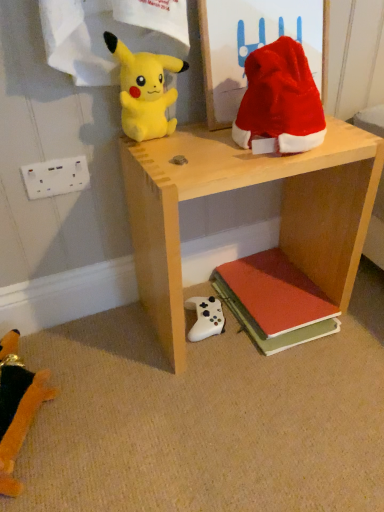
Image resolution: width=384 pixels, height=512 pixels. What do you see at coordinates (239, 188) in the screenshot?
I see `light wood/unfinished wood shelf at center` at bounding box center [239, 188].

This screenshot has height=512, width=384. Find the location of `red matte book at lower right`. red matte book at lower right is located at coordinates (275, 301).

In order to face velvet red santa hat at upper right, which ranks as the second toy in top-to-bottom order, should I rotate leftwards or rightwards?

You should rotate right by 13.252 degrees.

This screenshot has height=512, width=384. Describe the element at coordinates (17, 407) in the screenshot. I see `velvet orange stuffed toy at lower left, which is the 4th toy in top-to-bottom order` at that location.

Where is `light wood/unfinished wood shelf at center`? This screenshot has height=512, width=384. light wood/unfinished wood shelf at center is located at coordinates (239, 188).

Does velvet red santa hat at upper right, the 3th toy from the bottom, have a greater height compared to velvet orange stuffed toy at lower left, which is the 4th toy in top-to-bottom order?

Yes, velvet red santa hat at upper right, the 3th toy from the bottom, is taller than velvet orange stuffed toy at lower left, which is the 4th toy in top-to-bottom order.

Does velvet red santa hat at upper right, the first toy in the right-to-left sequence, have a smaller size compared to velvet orange stuffed toy at lower left, arranged as the first toy when viewed from the left?

No, velvet red santa hat at upper right, the first toy in the right-to-left sequence, is not smaller than velvet orange stuffed toy at lower left, arranged as the first toy when viewed from the left.

From a real-world perspective, starting from the velvet orange stuffed toy at lower left, which ranks as the 1th toy in bottom-to-top order, which toy is the 1st one vertically above it? Please provide its 2D coordinates.

[(280, 99)]

From a real-world perspective, who is located lower, velvet red santa hat at upper right, the 3th toy from the bottom, or velvet orange stuffed toy at lower left, which is the 4th toy in top-to-bottom order?

A: velvet orange stuffed toy at lower left, which is the 4th toy in top-to-bottom order.

How many degrees apart are the facing directions of light wood/unfinished wood shelf at center and yellow plush toy at upper left, the third toy when ordered from right to left?

There is a 3.13-degree angle between the facing directions of light wood/unfinished wood shelf at center and yellow plush toy at upper left, the third toy when ordered from right to left.

Do you think light wood/unfinished wood shelf at center is within yellow plush toy at upper left, the second toy when ordered from left to right, or outside of it?

light wood/unfinished wood shelf at center cannot be found inside yellow plush toy at upper left, the second toy when ordered from left to right.

Considering the sizes of objects light wood/unfinished wood shelf at center and yellow plush toy at upper left, which is counted as the first toy, starting from the top, in the image provided, who is shorter, light wood/unfinished wood shelf at center or yellow plush toy at upper left, which is counted as the first toy, starting from the top,?

yellow plush toy at upper left, which is counted as the first toy, starting from the top, is shorter.

Which is in front, point (7, 344) or point (292, 133)?

Positioned in front is point (292, 133).

Considering the relative positions of velvet orange stuffed toy at lower left, which ranks as the 1th toy in bottom-to-top order, and velvet red santa hat at upper right, which appears as the fourth toy when viewed from the left, in the image provided, is velvet orange stuffed toy at lower left, which ranks as the 1th toy in bottom-to-top order, to the left of velvet red santa hat at upper right, which appears as the fourth toy when viewed from the left, from the viewer's perspective?

Yes.

In the scene shown: Is velvet orange stuffed toy at lower left, arranged as the first toy when viewed from the left, far away from velvet red santa hat at upper right, the first toy in the right-to-left sequence?

No, velvet orange stuffed toy at lower left, arranged as the first toy when viewed from the left, is in close proximity to velvet red santa hat at upper right, the first toy in the right-to-left sequence.

Where is `shelf located above the red matte book at lower right (from a real-world perspective)`? This screenshot has height=512, width=384. shelf located above the red matte book at lower right (from a real-world perspective) is located at coordinates (239, 188).

Considering the relative positions of red matte book at lower right and light wood/unfinished wood shelf at center in the image provided, is red matte book at lower right in front of light wood/unfinished wood shelf at center?

No, the depth of red matte book at lower right is greater than that of light wood/unfinished wood shelf at center.

Is red matte book at lower right situated inside light wood/unfinished wood shelf at center or outside?

red matte book at lower right lies within the bounds of light wood/unfinished wood shelf at center.

From the image's perspective, is red matte book at lower right above light wood/unfinished wood shelf at center?

No, from the image's perspective, red matte book at lower right is not on top of light wood/unfinished wood shelf at center.

Considering the positions of point (326, 251) and point (194, 298), is point (326, 251) closer or farther from the camera than point (194, 298)?

Clearly, point (326, 251) is closer to the camera than point (194, 298).

How many degrees apart are the facing directions of light wood/unfinished wood shelf at center and white matte game controller at lower center, the 3th toy positioned from the left?

10.5 degrees separate the facing orientations of light wood/unfinished wood shelf at center and white matte game controller at lower center, the 3th toy positioned from the left.

Which object is positioned more to the right, light wood/unfinished wood shelf at center or white matte game controller at lower center, placed as the third toy when sorted from top to bottom?

Positioned to the right is light wood/unfinished wood shelf at center.

Between white plastic/socket at lower left and velvet red santa hat at upper right, which appears as the fourth toy when viewed from the left, which one has larger width?

With larger width is velvet red santa hat at upper right, which appears as the fourth toy when viewed from the left.

Is point (84, 164) positioned in front of point (297, 96)?

No, (84, 164) is behind (297, 96).

At what (x,y) coordinates should I click in order to perform the action: click on toy that is the 1st one above the white plastic/socket at lower left (from a real-world perspective). Please return your answer as a coordinate pair (x, y). This screenshot has width=384, height=512. Looking at the image, I should click on (280, 99).

From the image's perspective, which one is positioned lower, velvet orange stuffed toy at lower left, which is the 4th toy in top-to-bottom order, or red matte book at lower right?

velvet orange stuffed toy at lower left, which is the 4th toy in top-to-bottom order, from the image's perspective.

Can you confirm if velvet orange stuffed toy at lower left, which ranks as the fourth toy in right-to-left order, is wider than red matte book at lower right?

Correct, the width of velvet orange stuffed toy at lower left, which ranks as the fourth toy in right-to-left order, exceeds that of red matte book at lower right.

How many degrees apart are the facing directions of velvet orange stuffed toy at lower left, which ranks as the 1th toy in bottom-to-top order, and red matte book at lower right?

They differ by 1.29 degrees in their facing directions.

Starting from the red matte book at lower right, which toy is the 4th one to the left? Please provide its 2D coordinates.

[(17, 407)]

The image size is (384, 512). What are the coordinates of `the 3rd toy to the left when counting from the velvet red santa hat at upper right, which appears as the fourth toy when viewed from the left` in the screenshot? It's located at (17, 407).

From the image's perspective, count 2nd toys upward from the light wood/unfinished wood shelf at center and point to it. Please provide its 2D coordinates.

[(144, 90)]

From the image, which object appears to be nearer to yellow plush toy at upper left, the third toy when ordered from right to left, velvet red santa hat at upper right, the 3th toy from the bottom, or red matte book at lower right?

Based on the image, velvet red santa hat at upper right, the 3th toy from the bottom, appears to be nearer to yellow plush toy at upper left, the third toy when ordered from right to left.

Based on their spatial positions, is white plastic/socket at lower left or white matte game controller at lower center, positioned as the second toy in bottom-to-top order, further from velvet red santa hat at upper right, the first toy in the right-to-left sequence?

white matte game controller at lower center, positioned as the second toy in bottom-to-top order, is further to velvet red santa hat at upper right, the first toy in the right-to-left sequence.

Based on their spatial positions, is white matte game controller at lower center, placed as the third toy when sorted from top to bottom, or yellow plush toy at upper left, which is counted as the first toy, starting from the top, further from red matte book at lower right?

Among the two, yellow plush toy at upper left, which is counted as the first toy, starting from the top, is located further to red matte book at lower right.

From the image, which object appears to be nearer to red matte book at lower right, white matte game controller at lower center, placed as the third toy when sorted from top to bottom, or white plastic/socket at lower left?

white matte game controller at lower center, placed as the third toy when sorted from top to bottom.

Based on their spatial positions, is red matte book at lower right or velvet orange stuffed toy at lower left, which is the 4th toy in top-to-bottom order, further from yellow plush toy at upper left, the third toy when ordered from right to left?

Among the two, velvet orange stuffed toy at lower left, which is the 4th toy in top-to-bottom order, is located further to yellow plush toy at upper left, the third toy when ordered from right to left.

Considering their positions, is velvet red santa hat at upper right, which ranks as the second toy in top-to-bottom order, positioned further to yellow plush toy at upper left, the third toy when ordered from right to left, than white plastic/socket at lower left?

white plastic/socket at lower left is further to yellow plush toy at upper left, the third toy when ordered from right to left.

Based on their spatial positions, is white plastic/socket at lower left or velvet orange stuffed toy at lower left, arranged as the first toy when viewed from the left, closer to light wood/unfinished wood shelf at center?

white plastic/socket at lower left is closer to light wood/unfinished wood shelf at center.

Estimate the real-world distances between objects in this image. Which object is closer to white matte game controller at lower center, positioned as the second toy in bottom-to-top order, yellow plush toy at upper left, which is counted as the first toy, starting from the top, or red matte book at lower right?

The object closer to white matte game controller at lower center, positioned as the second toy in bottom-to-top order, is red matte book at lower right.

Locate an element on the screen. The image size is (384, 512). book between velvet red santa hat at upper right, the first toy in the right-to-left sequence, and white matte game controller at lower center, which is the 2th toy in right-to-left order, in the vertical direction is located at coordinates (275, 301).

Where is `book between yellow plush toy at upper left, the third toy when ordered from right to left, and white matte game controller at lower center, which is the 2th toy in right-to-left order, from top to bottom`? The image size is (384, 512). book between yellow plush toy at upper left, the third toy when ordered from right to left, and white matte game controller at lower center, which is the 2th toy in right-to-left order, from top to bottom is located at coordinates (275, 301).

The image size is (384, 512). I want to click on book between yellow plush toy at upper left, the 4th toy when ordered from bottom to top, and velvet orange stuffed toy at lower left, which ranks as the fourth toy in right-to-left order, in the up-down direction, so click(275, 301).

Where is `shelf situated between white plastic/socket at lower left and red matte book at lower right from left to right`? Image resolution: width=384 pixels, height=512 pixels. shelf situated between white plastic/socket at lower left and red matte book at lower right from left to right is located at coordinates (239, 188).